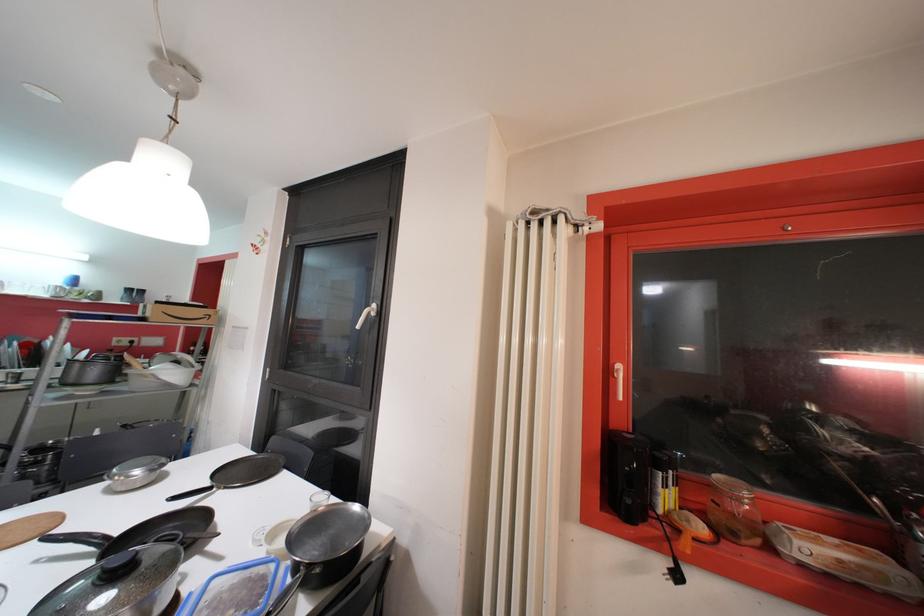
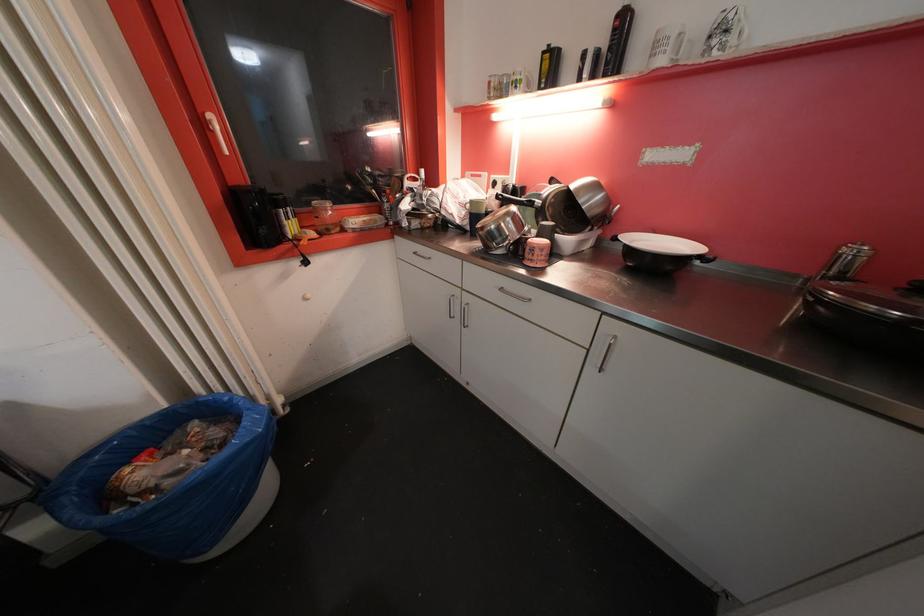
Locate, in the second image, the point that corresponds to [624,369] in the first image.

(215, 119)